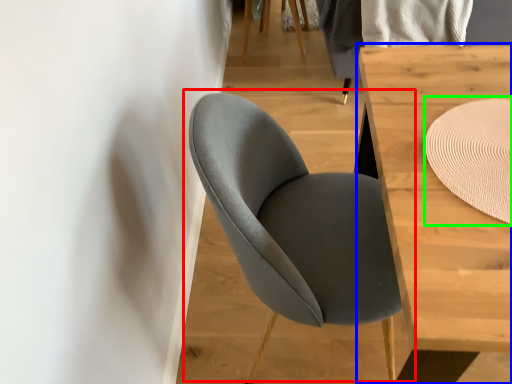
Question: Which is nearer to the chair (highlighted by a red box)? table (highlighted by a blue box) or mat (highlighted by a green box).

Choices:
 (A) table
 (B) mat

Answer: (A)